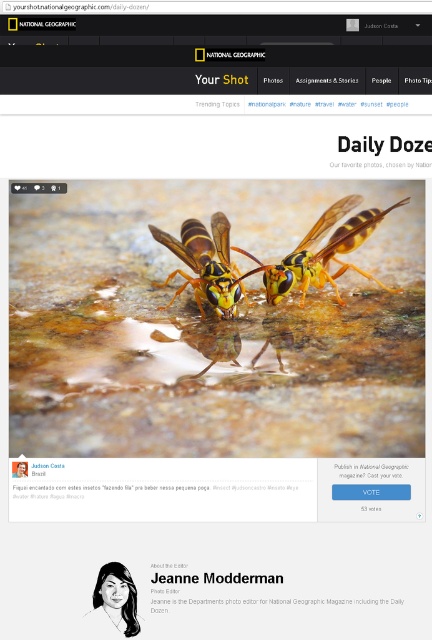
From the picture: Is yellow striped wasp at center further to the viewer compared to black paper text at center?

Yes, yellow striped wasp at center is further from the viewer.

The height and width of the screenshot is (640, 432). What do you see at coordinates (206, 264) in the screenshot? I see `yellow striped wasp at center` at bounding box center [206, 264].

Locate an element on the screen. Image resolution: width=432 pixels, height=640 pixels. yellow striped wasp at center is located at coordinates pos(206,264).

Does yellow matte wasp at center have a smaller size compared to black paper text at center?

Incorrect, yellow matte wasp at center is not smaller in size than black paper text at center.

From the picture: Measure the distance from yellow matte wasp at center to black paper text at center.

yellow matte wasp at center and black paper text at center are 84.92 centimeters apart.

Which is behind, point (324, 275) or point (251, 577)?

Point (324, 275)

Locate an element on the screen. The width and height of the screenshot is (432, 640). yellow matte wasp at center is located at coordinates (320, 252).

Does yellow matte wasp at center have a greater width compared to yellow striped wasp at center?

Correct, the width of yellow matte wasp at center exceeds that of yellow striped wasp at center.

Consider the image. Does yellow matte wasp at center come in front of yellow striped wasp at center?

Yes, it is.

The image size is (432, 640). Describe the element at coordinates (320, 252) in the screenshot. I see `yellow matte wasp at center` at that location.

Locate an element on the screen. yellow matte wasp at center is located at coordinates (320, 252).